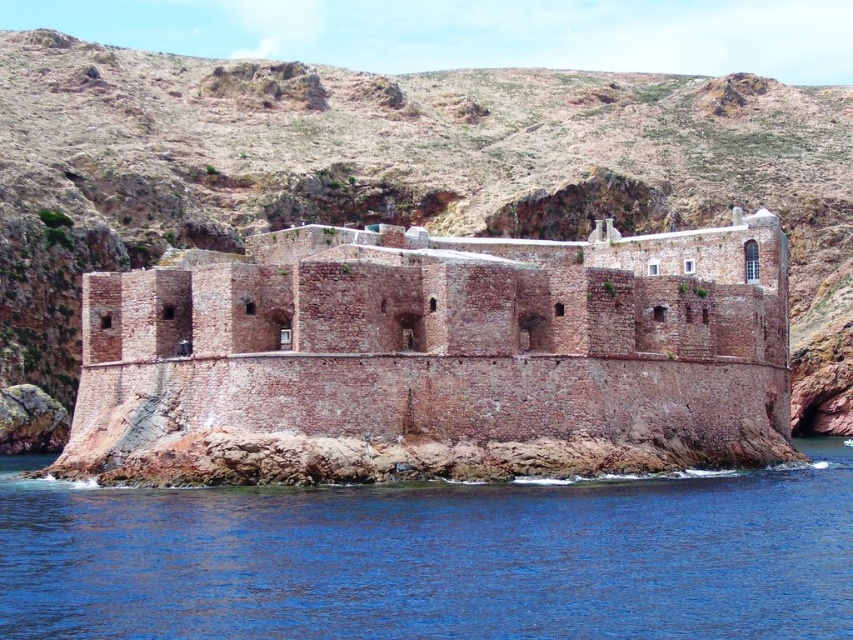
Is brown stone castle at center wider than blue water at lower left?

Incorrect, brown stone castle at center's width does not surpass blue water at lower left's.

Between point (177, 355) and point (345, 605), which one is positioned behind?

The point (177, 355) is more distant.

At what (x,y) coordinates should I click in order to perform the action: click on brown stone castle at center. Please return your answer as a coordinate pair (x, y). The image size is (853, 640). Looking at the image, I should click on (436, 356).

Does rustic stone hillside at upper center come behind blue water at lower left?

Yes.

Between rustic stone hillside at upper center and blue water at lower left, which one is positioned lower?

blue water at lower left

Which is in front, point (683, 198) or point (1, 547)?

Point (1, 547) is more forward.

At what (x,y) coordinates should I click in order to perform the action: click on rustic stone hillside at upper center. Please return your answer as a coordinate pair (x, y). The height and width of the screenshot is (640, 853). Looking at the image, I should click on (399, 173).

Who is higher up, brown stone castle at center or rustic stone hillside at upper center?

rustic stone hillside at upper center is above.

Which is behind, point (641, 385) or point (790, 214)?

The point (790, 214) is behind.

Who is more forward, (521, 284) or (99, 60)?

Positioned in front is point (521, 284).

This screenshot has height=640, width=853. What are the coordinates of `brown stone castle at center` in the screenshot? It's located at (436, 356).